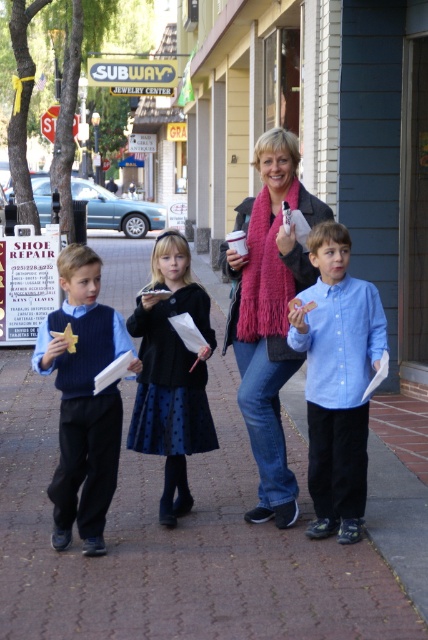
Question: Is the position of blue button-down shirt at center more distant than that of black wool sweater at center?

Choices:
 (A) no
 (B) yes

Answer: (A)

Question: Among these objects, which one is farthest from the camera?

Choices:
 (A) blue button-down shirt at center
 (B) matte blue sweater at left
 (C) brown brick pavement at center

Answer: (A)

Question: Which object appears farthest from the camera in this image?

Choices:
 (A) black wool sweater at center
 (B) blue button-down shirt at center
 (C) pink scarf at center
 (D) brown brick pavement at center

Answer: (A)

Question: Is blue button-down shirt at center positioned in front of black wool sweater at center?

Choices:
 (A) no
 (B) yes

Answer: (B)

Question: Can you confirm if blue button-down shirt at center is smaller than black wool sweater at center?

Choices:
 (A) no
 (B) yes

Answer: (B)

Question: Which of these objects is positioned closest to the blue button-down shirt at center?

Choices:
 (A) brown brick pavement at center
 (B) pink scarf at center

Answer: (B)